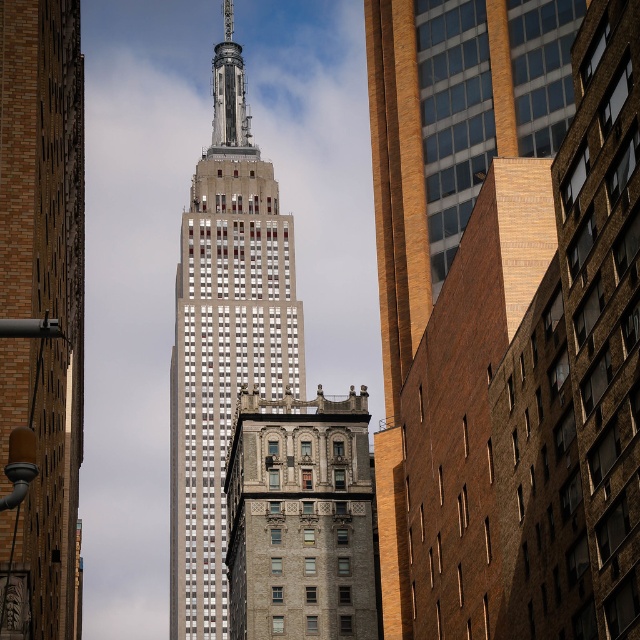
Can you confirm if white marble tower at center is positioned below gray stone building at center?

Incorrect, white marble tower at center is not positioned below gray stone building at center.

Between point (173, 432) and point (332, 515), which one is positioned behind?

The point (173, 432) is behind.

Is point (225, 92) more distant than point (337, 609)?

That is True.

Identify the location of white marble tower at center. (224, 337).

Between white glass skyscraper at center and white marble tower at center, which one appears on the right side from the viewer's perspective?

From the viewer's perspective, white marble tower at center appears more on the right side.

Looking at this image, does white glass skyscraper at center appear on the left side of white marble tower at center?

Yes, white glass skyscraper at center is to the left of white marble tower at center.

This screenshot has height=640, width=640. Identify the location of white glass skyscraper at center. (42, 305).

Between point (44, 212) and point (358, 458), which one is positioned behind?

The point (358, 458) is more distant.

What do you see at coordinates (42, 305) in the screenshot? I see `white glass skyscraper at center` at bounding box center [42, 305].

At what (x,y) coordinates should I click in order to perform the action: click on white glass skyscraper at center. Please return your answer as a coordinate pair (x, y). Looking at the image, I should click on (42, 305).